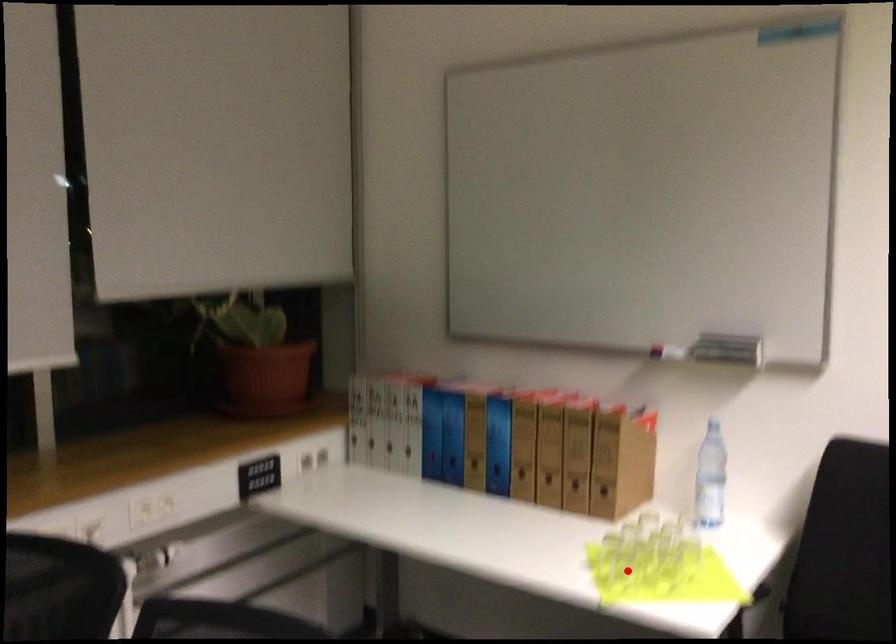
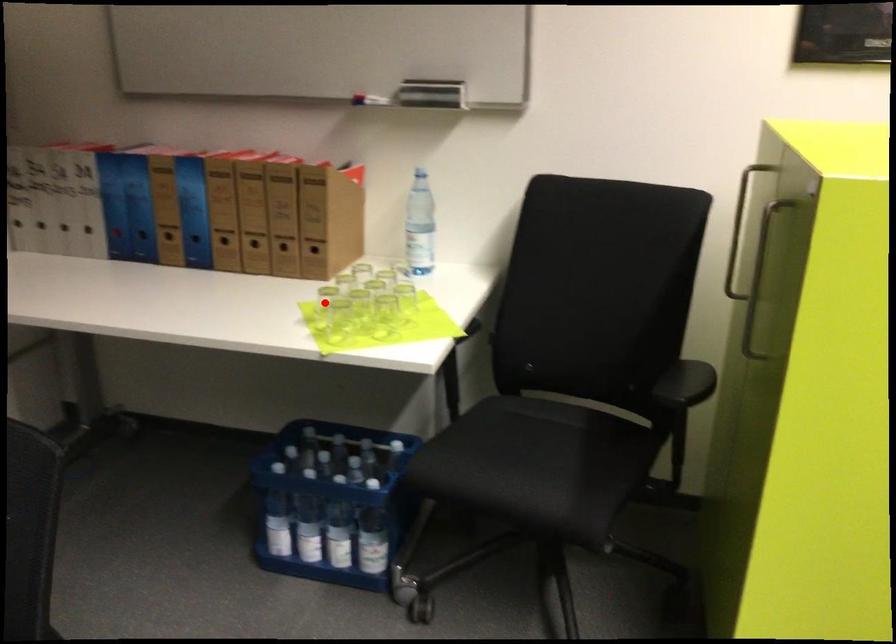
I am providing you with two images of the same scene from different viewpoints. A red point is marked on the first image and another point is marked on the second image. Is the marked point in image1 the same physical position as the marked point in image2?

No